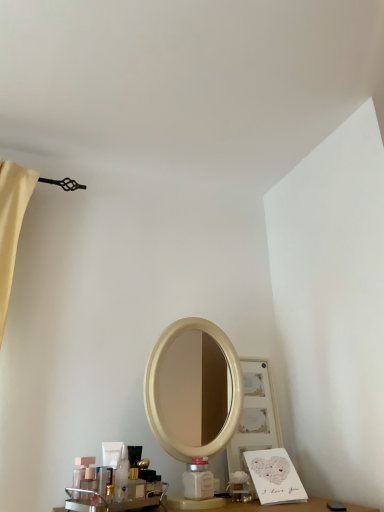
Describe the element at coordinates (89, 480) in the screenshot. I see `translucent plastic bottle at lower left` at that location.

What is the approximate height of translucent plastic bottle at lower left?

3.36 inches.

Where is `translucent plastic bottle at lower left`? translucent plastic bottle at lower left is located at coordinates (89, 480).

Where is `translucent plastic bottle at lower left`? translucent plastic bottle at lower left is located at coordinates (89, 480).